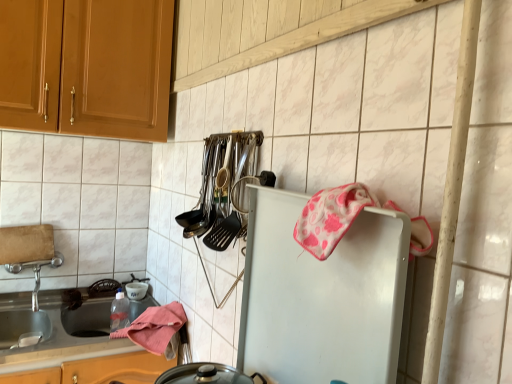
Question: Is the depth of pink fabric towel at lower left, which ranks as the first material in back-to-front order, greater than that of white matte refrigerator at center-right?

Choices:
 (A) no
 (B) yes

Answer: (B)

Question: Can you confirm if pink fabric towel at lower left, placed as the second material when sorted from top to bottom, is smaller than white matte refrigerator at center-right?

Choices:
 (A) no
 (B) yes

Answer: (A)

Question: Does pink fabric towel at lower left, which is the second material in front-to-back order, appear on the left side of white matte refrigerator at center-right?

Choices:
 (A) no
 (B) yes

Answer: (B)

Question: Is pink fabric towel at lower left, the 1th material ordered from the bottom, completely or partially outside of white matte refrigerator at center-right?

Choices:
 (A) yes
 (B) no

Answer: (A)

Question: Is pink fabric towel at lower left, placed as the second material when sorted from top to bottom, not close to white matte refrigerator at center-right?

Choices:
 (A) yes
 (B) no

Answer: (B)

Question: From the image's perspective, is pink fabric towel at lower left, placed as the second material when sorted from top to bottom, beneath white matte refrigerator at center-right?

Choices:
 (A) yes
 (B) no

Answer: (A)

Question: From a real-world perspective, is white glossy countertop at lower left below white matte refrigerator at center-right?

Choices:
 (A) yes
 (B) no

Answer: (A)

Question: Is white glossy countertop at lower left positioned in front of white matte refrigerator at center-right?

Choices:
 (A) yes
 (B) no

Answer: (B)

Question: Would you say white matte refrigerator at center-right is part of white glossy countertop at lower left's contents?

Choices:
 (A) no
 (B) yes

Answer: (A)

Question: Is white glossy countertop at lower left taller than white matte refrigerator at center-right?

Choices:
 (A) no
 (B) yes

Answer: (A)

Question: Does white glossy countertop at lower left have a lesser width compared to white matte refrigerator at center-right?

Choices:
 (A) no
 (B) yes

Answer: (A)

Question: Can you confirm if white glossy countertop at lower left is wider than white matte refrigerator at center-right?

Choices:
 (A) no
 (B) yes

Answer: (B)

Question: Considering the relative sizes of polished stainless steel utensils at center and pink fabric towel at lower left, the 1th material ordered from the bottom, in the image provided, is polished stainless steel utensils at center wider than pink fabric towel at lower left, the 1th material ordered from the bottom,?

Choices:
 (A) yes
 (B) no

Answer: (B)